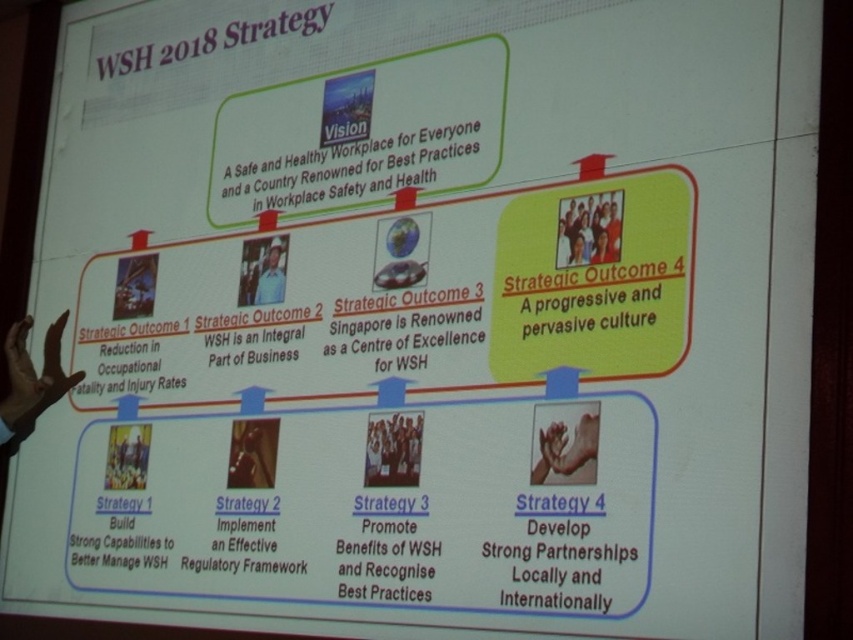
Question: Which of the following is the farthest from the observer?

Choices:
 (A) white glossy people at center
 (B) white hard hat at center
 (C) dark skin hand at lower left

Answer: (C)

Question: Which point appears closest to the camera in this image?

Choices:
 (A) (256, 285)
 (B) (374, 477)

Answer: (B)

Question: Does yellow fabric group at upper center appear on the left side of white hard hat at center?

Choices:
 (A) yes
 (B) no

Answer: (B)

Question: Can you confirm if white glossy people at center is thinner than white hard hat at center?

Choices:
 (A) no
 (B) yes

Answer: (A)

Question: Is yellow fabric group at upper center above white glossy people at center?

Choices:
 (A) yes
 (B) no

Answer: (A)

Question: Based on their relative distances, which object is nearer to the dark skin hand at lower left?

Choices:
 (A) white glossy people at center
 (B) white hard hat at center
 (C) yellow fabric group at upper center

Answer: (B)